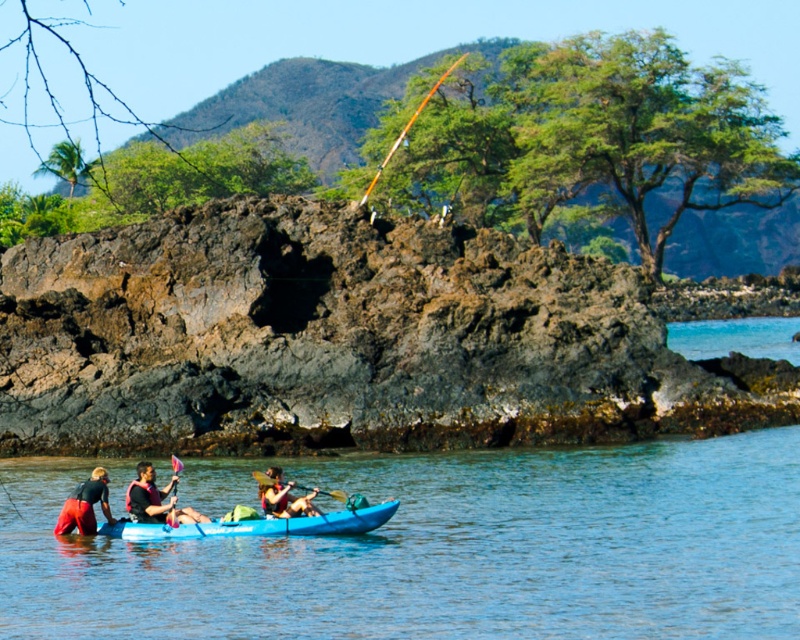
Does blue smooth water at center have a smaller size compared to matte red kayak at center?

Incorrect, blue smooth water at center is not smaller in size than matte red kayak at center.

This screenshot has height=640, width=800. What do you see at coordinates (440, 548) in the screenshot?
I see `blue smooth water at center` at bounding box center [440, 548].

Locate an element on the screen. blue smooth water at center is located at coordinates (440, 548).

Between blue plastic canoe at center and matte red kayak at center, which one has less height?

Standing shorter between the two is blue plastic canoe at center.

Is blue plastic canoe at center shorter than matte red kayak at center?

Yes.

Between point (362, 524) and point (268, 490), which one is positioned in front?

Point (362, 524) is more forward.

At what (x,y) coordinates should I click in order to perform the action: click on blue plastic canoe at center. Please return your answer as a coordinate pair (x, y). Looking at the image, I should click on (260, 525).

Can you confirm if matte red kayak at lower center is positioned to the right of brushed metal paddle at lower left?

Indeed, matte red kayak at lower center is positioned on the right side of brushed metal paddle at lower left.

Is point (130, 504) farther from camera compared to point (174, 460)?

Yes, point (130, 504) is farther from viewer.

This screenshot has width=800, height=640. In order to click on matte red kayak at lower center in this screenshot , I will do `click(156, 500)`.